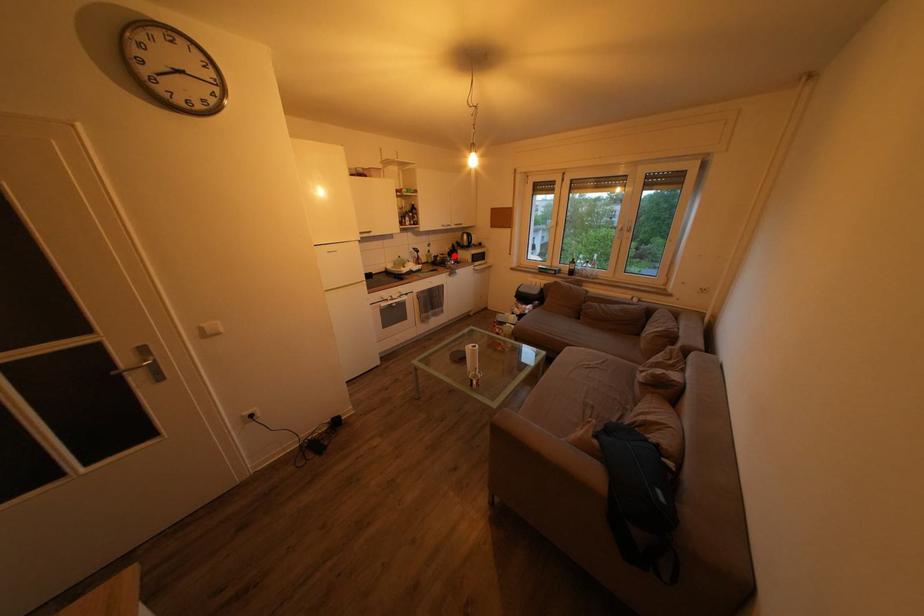
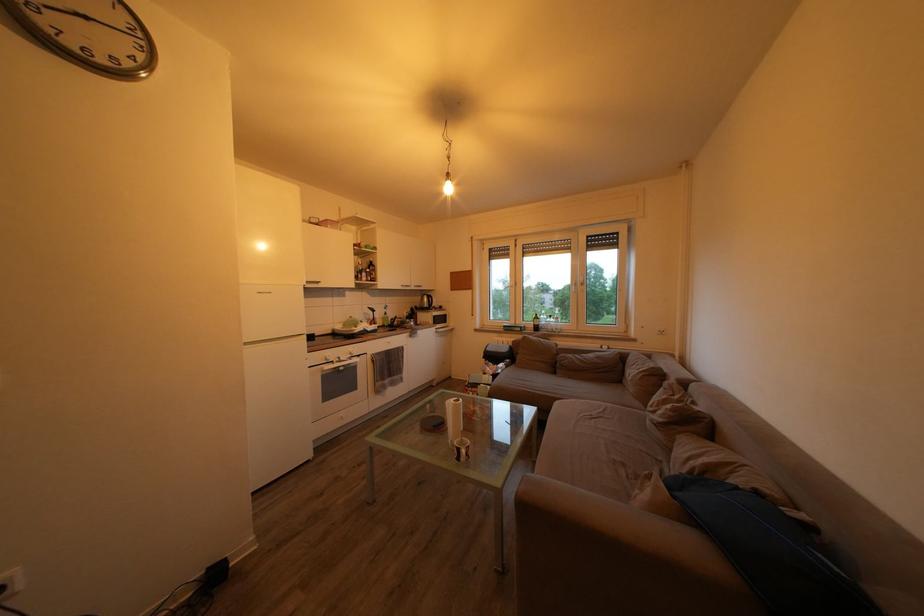
Question: A red point is marked in image1. In image2, is the corresponding 3D point closer to the camera or farther? Reply with the corresponding letter.

Choices:
 (A) The corresponding 3D point is closer.
 (B) The corresponding 3D point is farther.

Answer: (B)